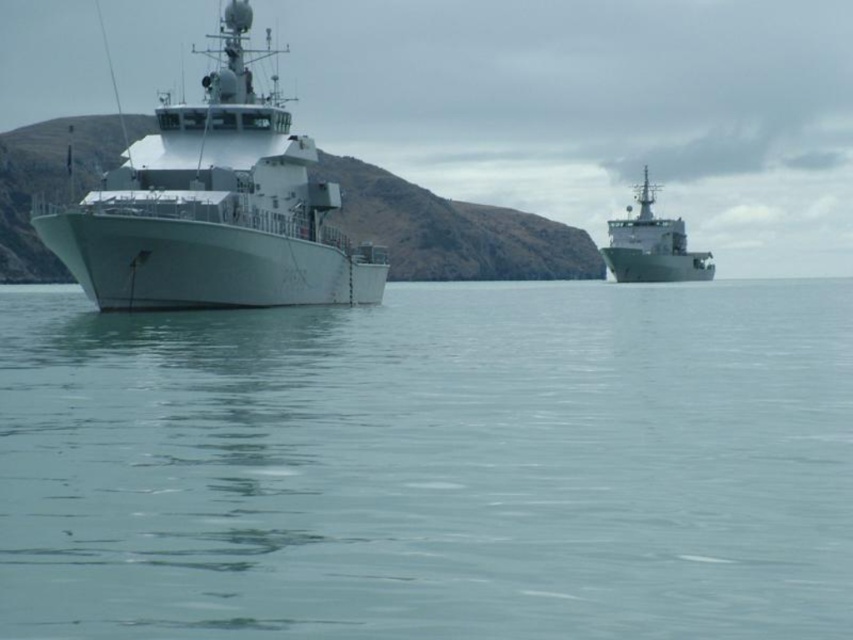
You are a sailor on the white matte ship at left and want to signal the metallic gray ship at upper right. Since you can only use a flag that can be seen from above, will your signal be visible to them?

The white matte ship at left is located above the metallic gray ship at upper right, so the flag signal from the white matte ship at left would be visible to the metallic gray ship at upper right from above.

You are an observer on a boat and you see the metallic gray ship at upper right and the clear blue water at center. Which object is nearer to you?

The clear blue water at center is closer to the viewer than the metallic gray ship at upper right, so the clear blue water at center is nearer to you.

You are a drone operator controlling a drone that needs to hover exactly at point [740,403]. The drone has a maximum flight range of 80 feet from the camera position. Can you confirm if the drone can reach that point?

The distance of point [740,403] from camera is 84.07 feet, which exceeds the drone maximum flight range of 80 feet. Therefore, the drone cannot reach that point.